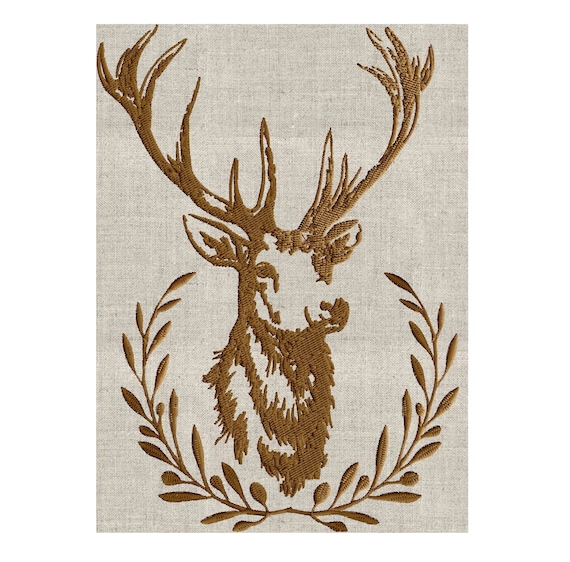
This screenshot has width=570, height=562. In order to click on wreath in this screenshot , I will do `click(225, 500)`, `click(369, 500)`.